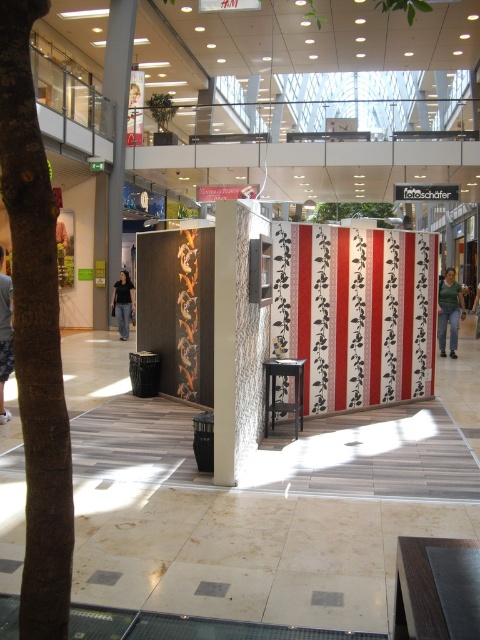
You are a store employee who needs to place a new mannequin that is 1.8 meters tall. You see the brown rough bark tree at left and the light brown leather jacket at lower left. Which object is a better reference point to ensure the mannequin won

The brown rough bark tree at left is taller than the light brown leather jacket at lower left. Since the mannequin is 1.8 meters tall, the tree would be a better reference point to ensure the mannequin is placed appropriately in terms of height comparison.

You are a customer looking for a specific item in the shopping mall. You see two green fabric sections labeled as green fabric at right and green fabric at center. Which one is positioned lower in the display area?

The green fabric at right is positioned lower than the green fabric at center in the display area.

You are a store employee who needs to place a light brown leather jacket at lower left near the brown rough bark tree at left. Based on the scene description, where should you position the jacket relative to the tree?

The brown rough bark tree at left is to the right of the light brown leather jacket at lower left, so the jacket should be placed to the left of the tree.